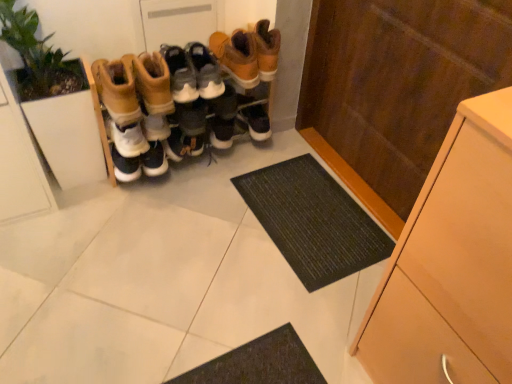
Question: Is green leafy plant at left located within leather boots at center, the 1th footwear in the left-to-right sequence?

Choices:
 (A) no
 (B) yes

Answer: (A)

Question: Is leather boots at center, the 3th footwear viewed from the right, completely or partially outside of green leafy plant at left?

Choices:
 (A) no
 (B) yes

Answer: (B)

Question: Considering the relative sizes of leather boots at center, the 3th footwear viewed from the right, and green leafy plant at left in the image provided, is leather boots at center, the 3th footwear viewed from the right, shorter than green leafy plant at left?

Choices:
 (A) yes
 (B) no

Answer: (A)

Question: Is leather boots at center, the 1th footwear in the left-to-right sequence, oriented away from green leafy plant at left?

Choices:
 (A) no
 (B) yes

Answer: (A)

Question: Considering the positions of green leafy plant at left and leather boots at center, the 3th footwear viewed from the right, in the image, is green leafy plant at left bigger or smaller than leather boots at center, the 3th footwear viewed from the right,?

Choices:
 (A) small
 (B) big

Answer: (B)

Question: In terms of width, does green leafy plant at left look wider or thinner when compared to leather boots at center, the 1th footwear in the left-to-right sequence?

Choices:
 (A) wide
 (B) thin

Answer: (B)

Question: Is green leafy plant at left in front of or behind leather boots at center, the 3th footwear viewed from the right, in the image?

Choices:
 (A) front
 (B) behind

Answer: (A)

Question: Is green leafy plant at left inside or outside of leather boots at center, the 1th footwear in the left-to-right sequence?

Choices:
 (A) outside
 (B) inside

Answer: (A)

Question: From the image's perspective, relative to light wood cabinet at right, is brown suede boots at center, the 1th footwear viewed from the right, above or below?

Choices:
 (A) above
 (B) below

Answer: (A)

Question: Is brown suede boots at center, the 1th footwear viewed from the right, bigger or smaller than light wood cabinet at right?

Choices:
 (A) small
 (B) big

Answer: (A)

Question: Visually, is brown suede boots at center, which appears as the 3th footwear when viewed from the left, positioned to the left or to the right of light wood cabinet at right?

Choices:
 (A) right
 (B) left

Answer: (B)

Question: From a real-world perspective, relative to light wood cabinet at right, is brown suede boots at center, which appears as the 3th footwear when viewed from the left, vertically above or below?

Choices:
 (A) above
 (B) below

Answer: (A)

Question: Is brown suede boots at center, which appears as the 3th footwear when viewed from the left, inside the boundaries of black rubber doormat at center, or outside?

Choices:
 (A) outside
 (B) inside

Answer: (A)

Question: Is point (245, 39) closer or farther from the camera than point (253, 190)?

Choices:
 (A) closer
 (B) farther

Answer: (A)